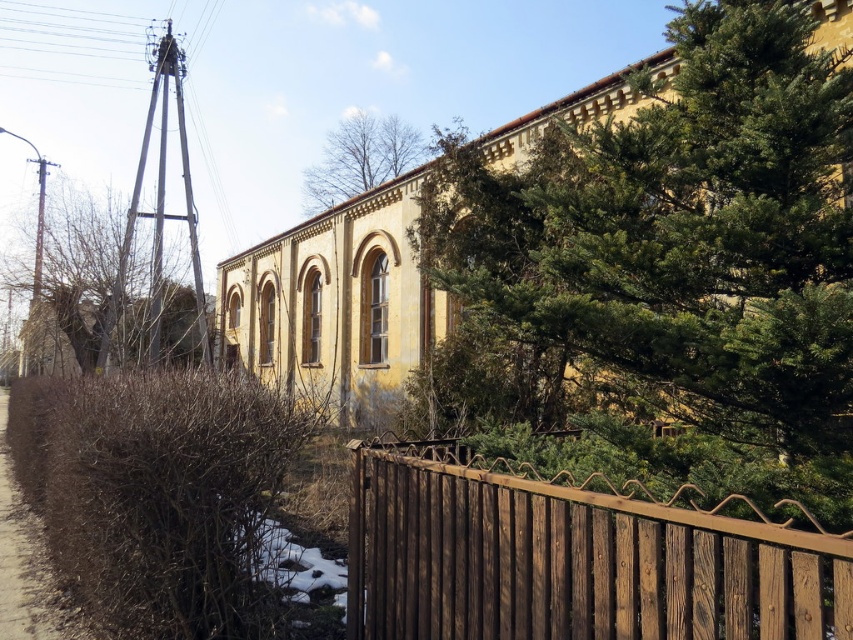
Question: Which object is closer to the camera taking this photo?

Choices:
 (A) bare branches at upper center
 (B) brown textured tree at left
 (C) green leafy tree at upper right
 (D) brown dirt at left

Answer: (C)

Question: Is green leafy tree at upper right closer to the viewer compared to bare branches at upper center?

Choices:
 (A) no
 (B) yes

Answer: (B)

Question: Is brown dirt at left wider than bare branches at upper center?

Choices:
 (A) no
 (B) yes

Answer: (A)

Question: Which is farther from the bare branches at upper center?

Choices:
 (A) green leafy tree at upper right
 (B) brown textured tree at left
 (C) brown wooden fence at lower right
 (D) brown dirt at left

Answer: (C)

Question: Among these objects, which one is farthest from the camera?

Choices:
 (A) green leafy tree at upper right
 (B) brown dirt at left
 (C) brown wooden fence at lower right
 (D) bare branches at upper center

Answer: (D)

Question: Is green leafy tree at upper right to the right of brown textured tree at left from the viewer's perspective?

Choices:
 (A) no
 (B) yes

Answer: (B)